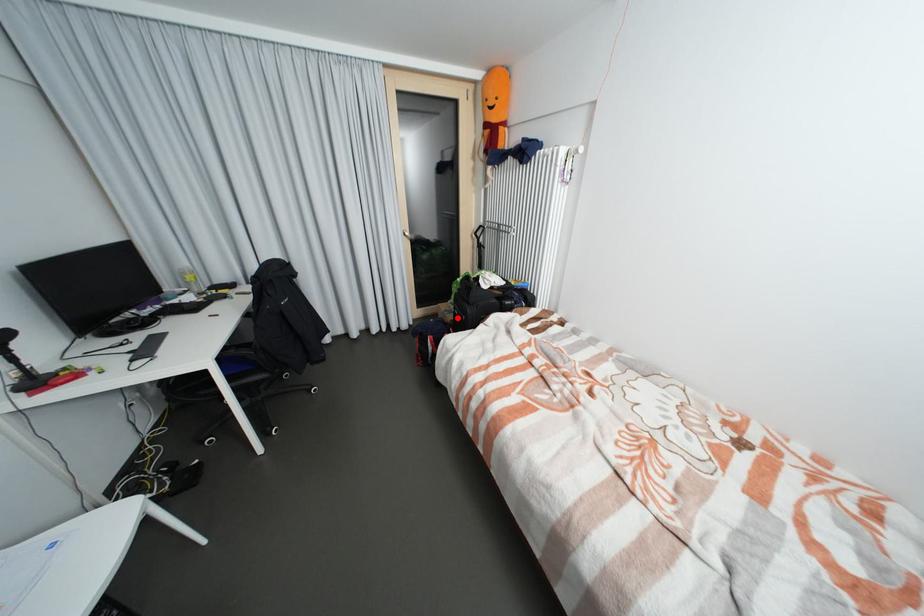
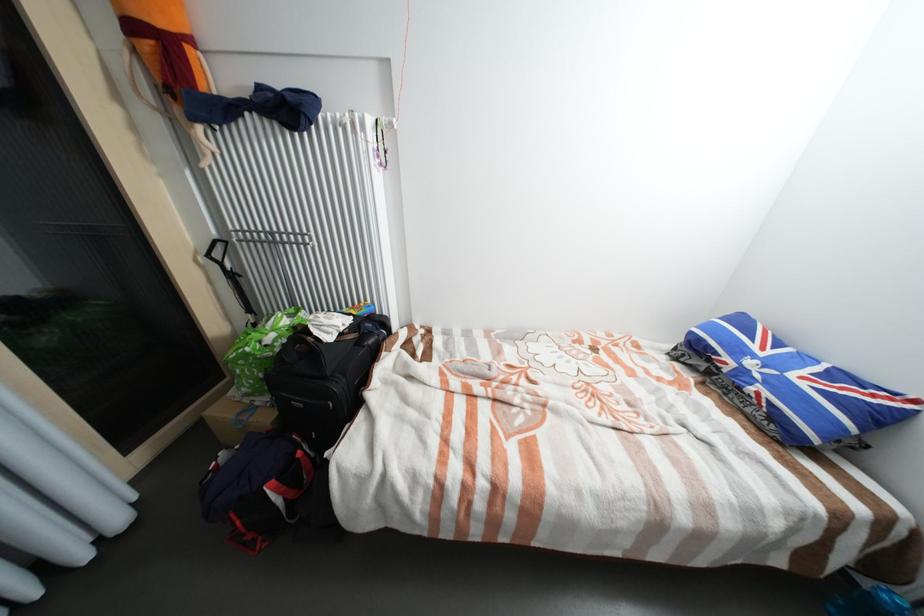
Find the pixel in the second image that matches the highlighted location in the first image.

(273, 419)